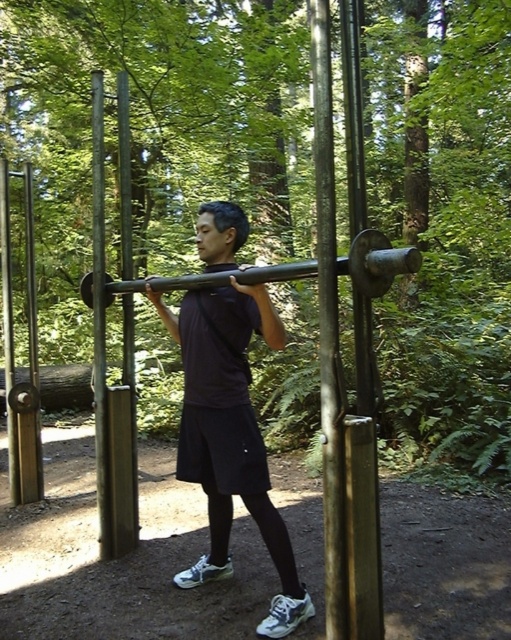
Question: Can you confirm if matte black shirt at center is positioned to the left of polished metal pole at center?

Choices:
 (A) no
 (B) yes

Answer: (A)

Question: Can you confirm if black metal barbell at center is positioned below polished metal pole at center?

Choices:
 (A) no
 (B) yes

Answer: (A)

Question: Based on their relative distances, which object is nearer to the matte black shirt at center?

Choices:
 (A) black metal barbell at center
 (B) brushed metal pole at center
 (C) polished metal pole at center

Answer: (A)

Question: Among these objects, which one is farthest from the camera?

Choices:
 (A) matte black shirt at center
 (B) black metal barbell at center
 (C) brushed metal pole at center

Answer: (A)

Question: Is black metal barbell at center to the right of polished metal pole at center from the viewer's perspective?

Choices:
 (A) no
 (B) yes

Answer: (B)

Question: Estimate the real-world distances between objects in this image. Which object is closer to the brushed metal pole at center?

Choices:
 (A) black metal barbell at center
 (B) matte black shirt at center

Answer: (B)